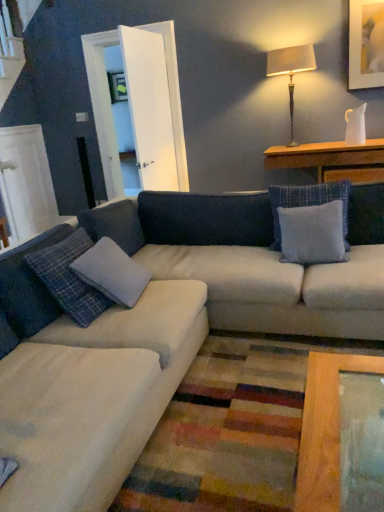
Where is `white fabric couch at center`? white fabric couch at center is located at coordinates (204, 289).

Where is `metallic gold table lamp at upper right`? This screenshot has width=384, height=512. metallic gold table lamp at upper right is located at coordinates (291, 70).

What is the approximate width of plaid fabric pillow at lower left, the 1th pillow positioned from the left?

plaid fabric pillow at lower left, the 1th pillow positioned from the left, is 10.10 inches in width.

This screenshot has height=512, width=384. What are the coordinates of `wooden table at upper right` in the screenshot? It's located at (x=332, y=160).

Describe the element at coordinates (366, 44) in the screenshot. The width and height of the screenshot is (384, 512). I see `matte gold picture frame at upper right` at that location.

Locate an element on the screen. white fabric couch at center is located at coordinates (204, 289).

From the image's perspective, relative to gray fabric pillow at center, which is the second pillow in left-to-right order, is metallic gold table lamp at upper right above or below?

metallic gold table lamp at upper right is situated higher than gray fabric pillow at center, which is the second pillow in left-to-right order, in the image.

In the scene shown: How distant is metallic gold table lamp at upper right from gray fabric pillow at center, which is the second pillow in left-to-right order?

metallic gold table lamp at upper right is 6.64 feet from gray fabric pillow at center, which is the second pillow in left-to-right order.

In terms of width, does metallic gold table lamp at upper right look wider or thinner when compared to gray fabric pillow at center, which is the second pillow in left-to-right order?

In the image, metallic gold table lamp at upper right appears to be more narrow than gray fabric pillow at center, which is the second pillow in left-to-right order.

Is metallic gold table lamp at upper right completely or partially outside of gray fabric pillow at center, which is the second pillow in left-to-right order?

metallic gold table lamp at upper right is positioned outside gray fabric pillow at center, which is the second pillow in left-to-right order.

Between matte gold picture frame at upper right and metallic gold table lamp at upper right, which one has larger size?

With larger size is metallic gold table lamp at upper right.

Considering the positions of point (357, 49) and point (270, 75), is point (357, 49) closer or farther from the camera than point (270, 75)?

Point (357, 49) appears to be closer to the viewer than point (270, 75).

Who is more distant, matte gold picture frame at upper right or metallic gold table lamp at upper right?

metallic gold table lamp at upper right is further from the camera.

Can you confirm if plaid fabric pillow at lower left, arranged as the second pillow when viewed from the right, is taller than wooden table at upper right?

Correct, plaid fabric pillow at lower left, arranged as the second pillow when viewed from the right, is much taller as wooden table at upper right.

There is a plaid fabric pillow at lower left, arranged as the second pillow when viewed from the right. At what (x,y) coordinates should I click in order to perform the action: click on table above it (from a real-world perspective). Please return your answer as a coordinate pair (x, y). This screenshot has height=512, width=384. Looking at the image, I should click on (332, 160).

Is plaid fabric pillow at lower left, arranged as the second pillow when viewed from the right, directly adjacent to wooden table at upper right?

No.

Looking at their sizes, would you say plaid fabric pillow at lower left, arranged as the second pillow when viewed from the right, is wider or thinner than wooden table at upper right?

Clearly, plaid fabric pillow at lower left, arranged as the second pillow when viewed from the right, has less width compared to wooden table at upper right.

Is white fabric couch at center positioned before gray fabric pillow at center, which is the second pillow in left-to-right order?

Yes, white fabric couch at center is in front of gray fabric pillow at center, which is the second pillow in left-to-right order.

Does white fabric couch at center turn towards gray fabric pillow at center, which is the second pillow in left-to-right order?

No, white fabric couch at center is not aimed at gray fabric pillow at center, which is the second pillow in left-to-right order.

From the picture: Is white fabric couch at center wider or thinner than gray fabric pillow at center, marked as the first pillow in a right-to-left arrangement?

Clearly, white fabric couch at center has more width compared to gray fabric pillow at center, marked as the first pillow in a right-to-left arrangement.

From the image's perspective, is white fabric couch at center above or below gray fabric pillow at center, which is the second pillow in left-to-right order?

white fabric couch at center is below gray fabric pillow at center, which is the second pillow in left-to-right order.

Which is in front, point (363, 30) or point (323, 212)?

The point (323, 212) is in front.

Where is `picture frame behind the gray fabric pillow at center, marked as the first pillow in a right-to-left arrangement`? The height and width of the screenshot is (512, 384). picture frame behind the gray fabric pillow at center, marked as the first pillow in a right-to-left arrangement is located at coordinates (366, 44).

Which object is closer to the camera, matte gold picture frame at upper right or gray fabric pillow at center, which is the second pillow in left-to-right order?

Positioned in front is gray fabric pillow at center, which is the second pillow in left-to-right order.

Which of these two, matte gold picture frame at upper right or gray fabric pillow at center, which is the second pillow in left-to-right order, is wider?

With larger width is gray fabric pillow at center, which is the second pillow in left-to-right order.

Is wooden table at upper right at the right side of plaid fabric pillow at lower left, arranged as the second pillow when viewed from the right?

Yes.

Which object is wider, wooden table at upper right or plaid fabric pillow at lower left, arranged as the second pillow when viewed from the right?

With larger width is wooden table at upper right.

Can you confirm if gray fabric pillow at center, marked as the first pillow in a right-to-left arrangement, is wider than matte gold picture frame at upper right?

Yes, gray fabric pillow at center, marked as the first pillow in a right-to-left arrangement, is wider than matte gold picture frame at upper right.

Does gray fabric pillow at center, which is the second pillow in left-to-right order, come in front of matte gold picture frame at upper right?

Yes, gray fabric pillow at center, which is the second pillow in left-to-right order, is closer to the viewer.

From the image's perspective, who appears lower, gray fabric pillow at center, which is the second pillow in left-to-right order, or matte gold picture frame at upper right?

gray fabric pillow at center, which is the second pillow in left-to-right order.

The height and width of the screenshot is (512, 384). Identify the location of picture frame behind the gray fabric pillow at center, which is the second pillow in left-to-right order. (366, 44).

Locate an element on the screen. the 2nd pillow located beneath the metallic gold table lamp at upper right (from a real-world perspective) is located at coordinates (312, 233).

In the image, there is a matte gold picture frame at upper right. Identify the location of table lamp below it (from the image's perspective). (x=291, y=70).

Which object lies nearer to the anchor point white fabric couch at center, metallic gold table lamp at upper right or wooden table at upper right?

wooden table at upper right is closer to white fabric couch at center.

Which object lies nearer to the anchor point gray fabric pillow at center, which is the second pillow in left-to-right order, matte gold picture frame at upper right or metallic gold table lamp at upper right?

Among the two, metallic gold table lamp at upper right is located nearer to gray fabric pillow at center, which is the second pillow in left-to-right order.

When comparing their distances from plaid fabric pillow at lower left, arranged as the second pillow when viewed from the right, does white fabric couch at center or wooden table at upper right seem closer?

white fabric couch at center is closer to plaid fabric pillow at lower left, arranged as the second pillow when viewed from the right.

Estimate the real-world distances between objects in this image. Which object is further from metallic gold table lamp at upper right, gray fabric pillow at center, marked as the first pillow in a right-to-left arrangement, or plaid fabric pillow at lower left, the 1th pillow positioned from the left?

The object further to metallic gold table lamp at upper right is plaid fabric pillow at lower left, the 1th pillow positioned from the left.

Based on their spatial positions, is white fabric couch at center or metallic gold table lamp at upper right closer to plaid fabric pillow at lower left, the 1th pillow positioned from the left?

white fabric couch at center.

Considering their positions, is gray fabric pillow at center, which is the second pillow in left-to-right order, positioned further to plaid fabric pillow at lower left, the 1th pillow positioned from the left, than wooden table at upper right?

wooden table at upper right lies further to plaid fabric pillow at lower left, the 1th pillow positioned from the left, than the other object.

From the image, which object appears to be farther from matte gold picture frame at upper right, wooden table at upper right or plaid fabric pillow at lower left, the 1th pillow positioned from the left?

The object further to matte gold picture frame at upper right is plaid fabric pillow at lower left, the 1th pillow positioned from the left.

Which object lies nearer to the anchor point metallic gold table lamp at upper right, wooden table at upper right or white fabric couch at center?

Among the two, wooden table at upper right is located nearer to metallic gold table lamp at upper right.

You are a GUI agent. You are given a task and a screenshot of the screen. Output one action in this format:
    pyautogui.click(x=<x>, y=<y>)
    Task: Click on the picture frame positioned between white fabric couch at center and metallic gold table lamp at upper right from near to far
    
    Given the screenshot: What is the action you would take?
    pyautogui.click(x=366, y=44)

Identify the location of table lamp between matte gold picture frame at upper right and gray fabric pillow at center, marked as the first pillow in a right-to-left arrangement, vertically. (291, 70).

This screenshot has width=384, height=512. Identify the location of table lamp that lies between matte gold picture frame at upper right and wooden table at upper right from top to bottom. (291, 70).

The image size is (384, 512). Find the location of `table between plaid fabric pillow at lower left, the 1th pillow positioned from the left, and matte gold picture frame at upper right, in the horizontal direction`. table between plaid fabric pillow at lower left, the 1th pillow positioned from the left, and matte gold picture frame at upper right, in the horizontal direction is located at coordinates (332, 160).